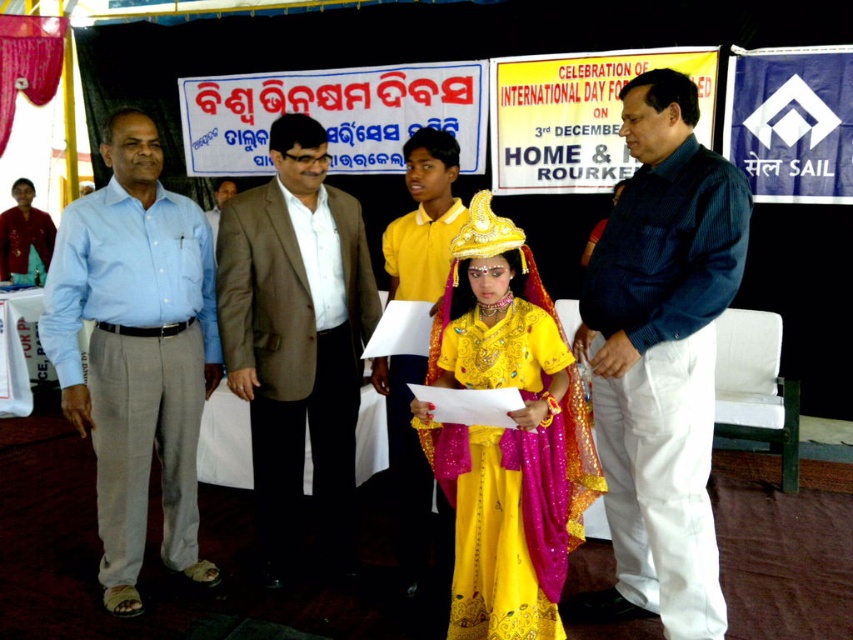
Question: Which point is farther from the camera taking this photo?

Choices:
 (A) pos(28,269)
 (B) pos(502,296)
 (C) pos(143,468)
 (D) pos(213,227)

Answer: (A)

Question: Can you confirm if light blue shirt at left is positioned to the right of brown textured suit at center?

Choices:
 (A) no
 (B) yes

Answer: (A)

Question: Based on their relative distances, which object is nearer to the matte black shirt at left?

Choices:
 (A) blue striped shirt at center
 (B) matte brown suit at center

Answer: (B)

Question: Can you confirm if shiny yellow fabric dress at center is positioned to the left of brown textured suit at center?

Choices:
 (A) yes
 (B) no

Answer: (B)

Question: Does shiny yellow fabric dress at center appear under matte brown suit at center?

Choices:
 (A) yes
 (B) no

Answer: (A)

Question: Which object is positioned farthest from the shiny yellow fabric dress at center?

Choices:
 (A) blue striped shirt at center
 (B) light brown suit at center

Answer: (B)